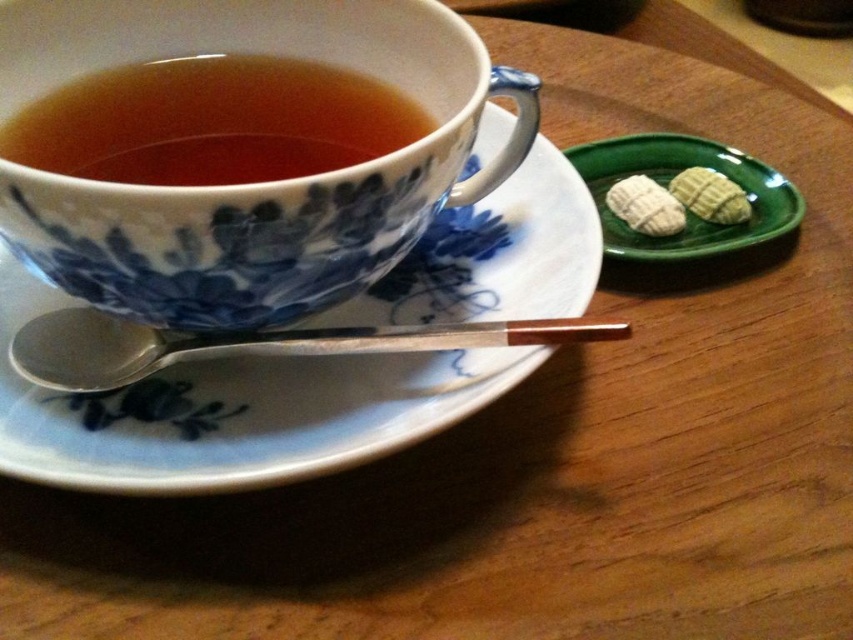
Question: Considering the real-world distances, which object is farthest from the white porcelain saucer at upper left?

Choices:
 (A) white textured cookies at upper right
 (B) blue porcelain cup at upper left
 (C) silver metallic spoon at lower left

Answer: (A)

Question: Is silver metallic spoon at lower left to the left of green matte plate at upper right from the viewer's perspective?

Choices:
 (A) no
 (B) yes

Answer: (B)

Question: Which object is the closest to the brown glossy cup at upper center?

Choices:
 (A) green matte plate at upper right
 (B) green textured cookie at upper right

Answer: (A)

Question: Does white porcelain saucer at upper left lie behind green matte plate at upper right?

Choices:
 (A) yes
 (B) no

Answer: (B)

Question: Which point is closer to the camera?

Choices:
 (A) green textured cookies at upper right
 (B) white textured cookies at upper right

Answer: (A)

Question: Can you confirm if brown glossy cup at upper center is thinner than green textured cookies at upper right?

Choices:
 (A) no
 (B) yes

Answer: (A)